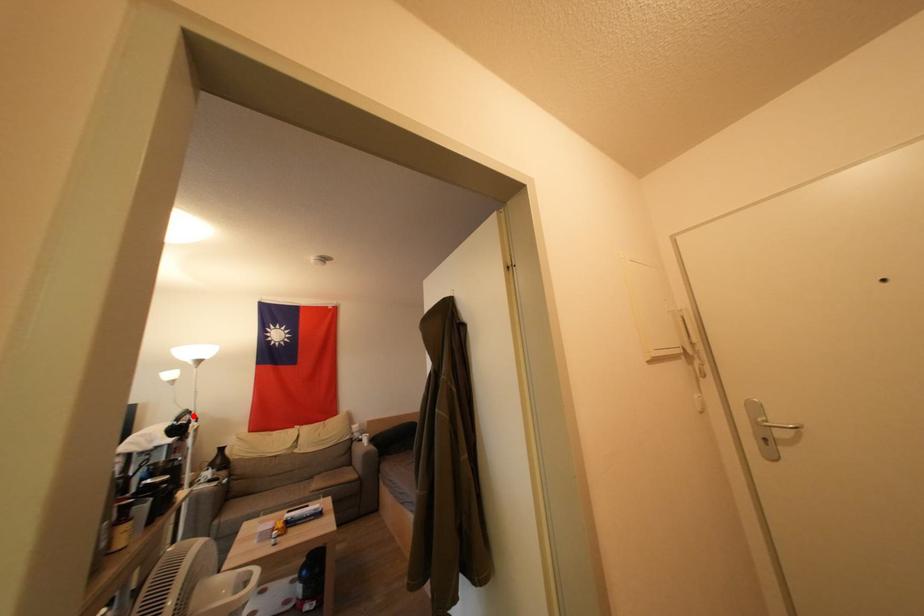
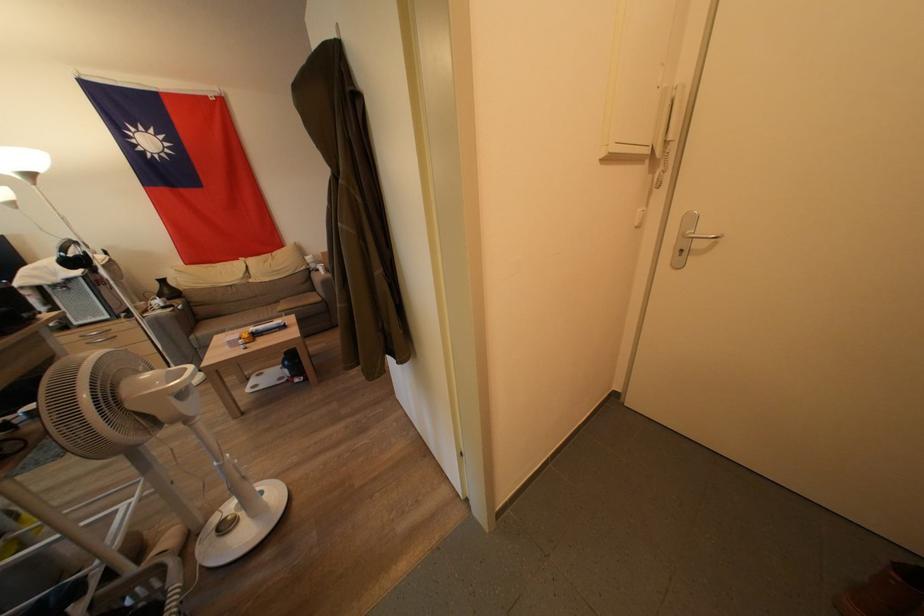
Question: I am providing you with two images of the same scene from different viewpoints. A red point is marked on the first image. Can you still see the location of the red point in image 2?

Choices:
 (A) Yes
 (B) No

Answer: (A)